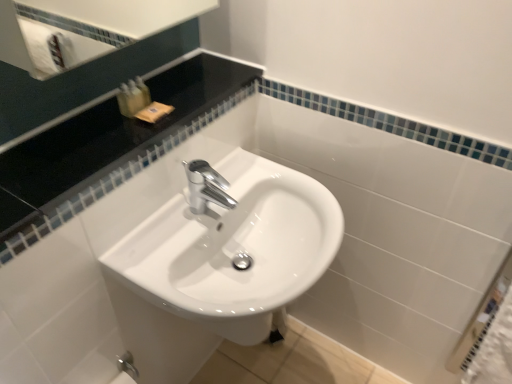
This screenshot has width=512, height=384. What do you see at coordinates (135, 97) in the screenshot? I see `translucent plastic soap dispenser at upper left, positioned as the 2th toiletry in right-to-left order` at bounding box center [135, 97].

Find the location of a particular element. translucent plastic soap at upper left, the 1th toiletry positioned from the left is located at coordinates (125, 101).

Identify the location of white glossy sink at center. (234, 250).

Where is `polished chrome tap at center`? The height and width of the screenshot is (384, 512). polished chrome tap at center is located at coordinates (206, 187).

I want to click on translucent plastic soap dispenser at upper left, positioned as the 2th toiletry in right-to-left order, so coord(135,97).

Is black glossy countertop at upper left located within translucent plastic soap at upper left, the 3th toiletry viewed from the right?

Actually, black glossy countertop at upper left is outside translucent plastic soap at upper left, the 3th toiletry viewed from the right.

From their relative heights in the image, would you say translucent plastic soap at upper left, the 3th toiletry viewed from the right, is taller or shorter than black glossy countertop at upper left?

In the image, translucent plastic soap at upper left, the 3th toiletry viewed from the right, appears to be taller than black glossy countertop at upper left.

Is translucent plastic soap at upper left, the 1th toiletry positioned from the left, next to black glossy countertop at upper left and touching it?

translucent plastic soap at upper left, the 1th toiletry positioned from the left, is not next to black glossy countertop at upper left, and they're not touching.

Who is more distant, translucent plastic soap at upper left, the 1th toiletry positioned from the left, or black glossy countertop at upper left?

translucent plastic soap at upper left, the 1th toiletry positioned from the left.

Where is `tap that appears below the translucent plastic soap at upper left, which is counted as the third toiletry, starting from the left (from a real-world perspective)`? Image resolution: width=512 pixels, height=384 pixels. tap that appears below the translucent plastic soap at upper left, which is counted as the third toiletry, starting from the left (from a real-world perspective) is located at coordinates tap(206, 187).

Is polished chrome tap at center oriented towards translucent plastic soap at upper left, which is counted as the third toiletry, starting from the left?

No, polished chrome tap at center is not oriented towards translucent plastic soap at upper left, which is counted as the third toiletry, starting from the left.

Which object is further away from the camera, polished chrome tap at center or translucent plastic soap at upper left, which is the 1th toiletry in right-to-left order?

translucent plastic soap at upper left, which is the 1th toiletry in right-to-left order, is behind.

Considering the positions of point (190, 197) and point (148, 94), is point (190, 197) closer or farther from the camera than point (148, 94)?

Point (190, 197) appears to be farther away from the viewer than point (148, 94).

From the image's perspective, would you say polished chrome tap at center is positioned over white glossy sink at center?

Yes, from the image's perspective, polished chrome tap at center is on top of white glossy sink at center.

Based on the photo, is polished chrome tap at center to the left of white glossy sink at center from the viewer's perspective?

Correct, you'll find polished chrome tap at center to the left of white glossy sink at center.

Looking at the image, does polished chrome tap at center seem bigger or smaller compared to white glossy sink at center?

Considering their sizes, polished chrome tap at center takes up less space than white glossy sink at center.

Find the location of a particular element. Image resolution: width=512 pixels, height=384 pixels. sink below the polished chrome tap at center (from the image's perspective) is located at coordinates (234, 250).

From the image's perspective, is translucent plastic soap at upper left, which is the 1th toiletry in right-to-left order, located beneath translucent plastic soap dispenser at upper left, which is counted as the 2th toiletry, starting from the left?

Incorrect, from the image's perspective, translucent plastic soap at upper left, which is the 1th toiletry in right-to-left order, is higher than translucent plastic soap dispenser at upper left, which is counted as the 2th toiletry, starting from the left.

In the image, there is a translucent plastic soap at upper left, which is counted as the third toiletry, starting from the left. Find the location of `toiletry below it (from a real-world perspective)`. toiletry below it (from a real-world perspective) is located at coordinates (135, 97).

Is translucent plastic soap at upper left, which is the 1th toiletry in right-to-left order, looking in the opposite direction of translucent plastic soap dispenser at upper left, positioned as the 2th toiletry in right-to-left order?

translucent plastic soap at upper left, which is the 1th toiletry in right-to-left order, does not have its back to translucent plastic soap dispenser at upper left, positioned as the 2th toiletry in right-to-left order.

Is translucent plastic soap at upper left, which is counted as the third toiletry, starting from the left, positioned far away from translucent plastic soap dispenser at upper left, which is counted as the 2th toiletry, starting from the left?

No, translucent plastic soap at upper left, which is counted as the third toiletry, starting from the left, is not far from translucent plastic soap dispenser at upper left, which is counted as the 2th toiletry, starting from the left.

In terms of width, does translucent plastic soap at upper left, which is the 1th toiletry in right-to-left order, look wider or thinner when compared to translucent plastic soap at upper left, the 1th toiletry positioned from the left?

In the image, translucent plastic soap at upper left, which is the 1th toiletry in right-to-left order, appears to be more narrow than translucent plastic soap at upper left, the 1th toiletry positioned from the left.

How many degrees apart are the facing directions of translucent plastic soap at upper left, which is counted as the third toiletry, starting from the left, and translucent plastic soap at upper left, the 3th toiletry viewed from the right?

There is a 0.000596-degree angle between the facing directions of translucent plastic soap at upper left, which is counted as the third toiletry, starting from the left, and translucent plastic soap at upper left, the 3th toiletry viewed from the right.

Does translucent plastic soap at upper left, which is counted as the third toiletry, starting from the left, contain translucent plastic soap at upper left, the 3th toiletry viewed from the right?

No, translucent plastic soap at upper left, the 3th toiletry viewed from the right, is located outside of translucent plastic soap at upper left, which is counted as the third toiletry, starting from the left.

Is translucent plastic soap dispenser at upper left, positioned as the 2th toiletry in right-to-left order, far from black glossy countertop at upper left?

No, translucent plastic soap dispenser at upper left, positioned as the 2th toiletry in right-to-left order, is in close proximity to black glossy countertop at upper left.

Is point (132, 84) closer to camera compared to point (21, 148)?

No, it is not.

You are a GUI agent. You are given a task and a screenshot of the screen. Output one action in this format:
    pyautogui.click(x=<x>, y=<y>)
    Task: Click on the counter top below the translucent plastic soap dispenser at upper left, positioned as the 2th toiletry in right-to-left order (from a real-world perspective)
    The width and height of the screenshot is (512, 384).
    Given the screenshot: What is the action you would take?
    pyautogui.click(x=111, y=147)

Is black glossy countertop at upper left at the back of translucent plastic soap dispenser at upper left, which is counted as the 2th toiletry, starting from the left?

No, translucent plastic soap dispenser at upper left, which is counted as the 2th toiletry, starting from the left,'s orientation is not away from black glossy countertop at upper left.

In the scene shown: Between black glossy countertop at upper left and white glossy sink at center, which one appears on the right side from the viewer's perspective?

white glossy sink at center is more to the right.

Can you confirm if black glossy countertop at upper left is wider than white glossy sink at center?

In fact, black glossy countertop at upper left might be narrower than white glossy sink at center.

Is black glossy countertop at upper left further to the viewer compared to white glossy sink at center?

No, black glossy countertop at upper left is in front of white glossy sink at center.

From the image's perspective, is black glossy countertop at upper left positioned above or below white glossy sink at center?

Clearly, from the image's perspective, black glossy countertop at upper left is above white glossy sink at center.

I want to click on the 1st toiletry positioned above the black glossy countertop at upper left (from the image's perspective), so click(x=125, y=101).

At what (x,y) coordinates should I click in order to perform the action: click on the 2nd toiletry above the polished chrome tap at center (from a real-world perspective). Please return your answer as a coordinate pair (x, y). The width and height of the screenshot is (512, 384). Looking at the image, I should click on (143, 90).

Based on the photo, considering their positions, is translucent plastic soap dispenser at upper left, which is counted as the 2th toiletry, starting from the left, positioned closer to polished chrome tap at center than white glossy sink at center?

white glossy sink at center lies closer to polished chrome tap at center than the other object.

When comparing their distances from polished chrome tap at center, does translucent plastic soap dispenser at upper left, which is counted as the 2th toiletry, starting from the left, or translucent plastic soap at upper left, the 3th toiletry viewed from the right, seem closer?

translucent plastic soap dispenser at upper left, which is counted as the 2th toiletry, starting from the left.

Considering their positions, is polished chrome tap at center positioned closer to black glossy countertop at upper left than translucent plastic soap dispenser at upper left, which is counted as the 2th toiletry, starting from the left?

translucent plastic soap dispenser at upper left, which is counted as the 2th toiletry, starting from the left, is closer to black glossy countertop at upper left.

Estimate the real-world distances between objects in this image. Which object is closer to translucent plastic soap at upper left, which is counted as the third toiletry, starting from the left, translucent plastic soap dispenser at upper left, which is counted as the 2th toiletry, starting from the left, or polished chrome tap at center?

translucent plastic soap dispenser at upper left, which is counted as the 2th toiletry, starting from the left, lies closer to translucent plastic soap at upper left, which is counted as the third toiletry, starting from the left, than the other object.

Considering their positions, is translucent plastic soap dispenser at upper left, which is counted as the 2th toiletry, starting from the left, positioned closer to translucent plastic soap at upper left, the 3th toiletry viewed from the right, than translucent plastic soap at upper left, which is counted as the third toiletry, starting from the left?

The object closer to translucent plastic soap at upper left, the 3th toiletry viewed from the right, is translucent plastic soap dispenser at upper left, which is counted as the 2th toiletry, starting from the left.

When comparing their distances from translucent plastic soap at upper left, the 3th toiletry viewed from the right, does polished chrome tap at center or white glossy sink at center seem closer?

polished chrome tap at center.

Which object lies nearer to the anchor point polished chrome tap at center, translucent plastic soap dispenser at upper left, positioned as the 2th toiletry in right-to-left order, or black glossy countertop at upper left?

black glossy countertop at upper left lies closer to polished chrome tap at center than the other object.

Which object lies nearer to the anchor point translucent plastic soap dispenser at upper left, positioned as the 2th toiletry in right-to-left order, black glossy countertop at upper left or white glossy sink at center?

The object closer to translucent plastic soap dispenser at upper left, positioned as the 2th toiletry in right-to-left order, is black glossy countertop at upper left.

The height and width of the screenshot is (384, 512). Identify the location of tap between translucent plastic soap dispenser at upper left, positioned as the 2th toiletry in right-to-left order, and white glossy sink at center vertically. (206, 187).

Identify the location of counter top between translucent plastic soap at upper left, the 1th toiletry positioned from the left, and white glossy sink at center vertically. The height and width of the screenshot is (384, 512). (111, 147).

You are a GUI agent. You are given a task and a screenshot of the screen. Output one action in this format:
    pyautogui.click(x=<x>, y=<y>)
    Task: Click on the tap that lies between translucent plastic soap at upper left, which is the 1th toiletry in right-to-left order, and white glossy sink at center from top to bottom
    The image size is (512, 384).
    Given the screenshot: What is the action you would take?
    pyautogui.click(x=206, y=187)

Image resolution: width=512 pixels, height=384 pixels. What are the coordinates of `tap between translucent plastic soap at upper left, the 1th toiletry positioned from the left, and white glossy sink at center from top to bottom` in the screenshot? It's located at (206, 187).